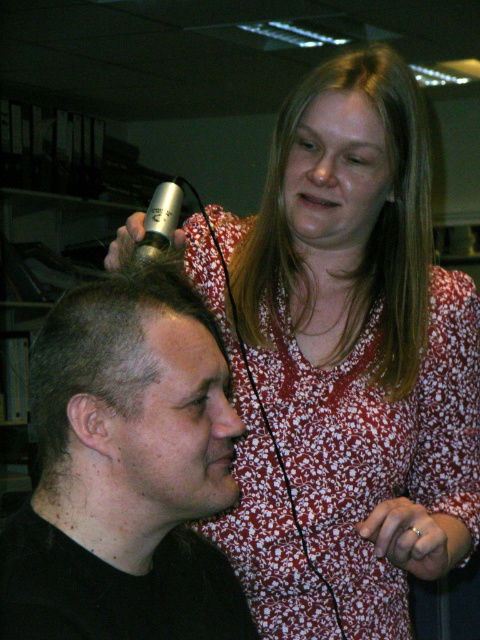
Consider the image. You are a photographer setting up a photo shoot in the scene described. You need to position a light source to illuminate the matte silver hair clipper at upper center. Given that the clipper is 38.11 inches from the camera, what is the minimum distance the light source should be placed from the camera to ensure it reaches the clipper?

The matte silver hair clipper at upper center is 38.11 inches from the camera, so the light source must be placed at least 38.11 inches away from the camera to ensure it reaches the clipper.